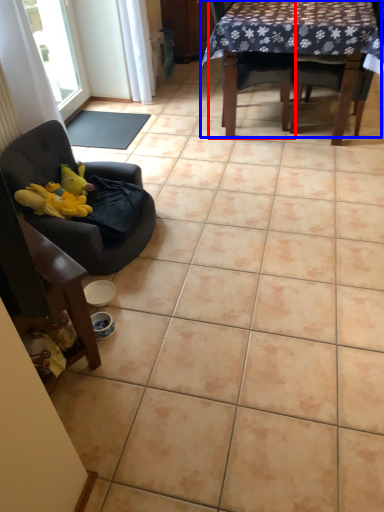
Question: Which object is further to the camera taking this photo, chair (highlighted by a red box) or table (highlighted by a blue box)?

Choices:
 (A) chair
 (B) table

Answer: (A)